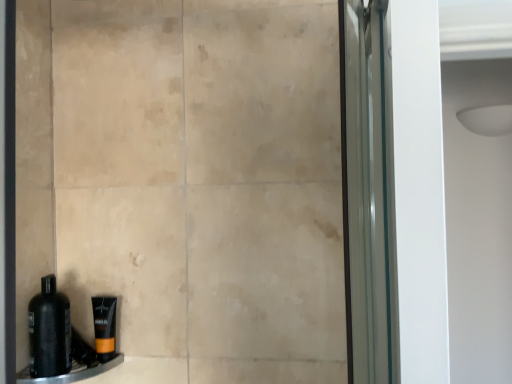
Question: Is orange matte tube at lower left to the left or to the right of black plastic ledge at lower left in the image?

Choices:
 (A) right
 (B) left

Answer: (A)

Question: From the image's perspective, is orange matte tube at lower left positioned above or below black plastic ledge at lower left?

Choices:
 (A) above
 (B) below

Answer: (A)

Question: Which of these objects is positioned closest to the black plastic ledge at lower left?

Choices:
 (A) black matte bottle at lower left
 (B) orange matte tube at lower left

Answer: (B)

Question: Which of these objects is positioned closest to the black matte bottle at lower left?

Choices:
 (A) black plastic ledge at lower left
 (B) orange matte tube at lower left

Answer: (A)